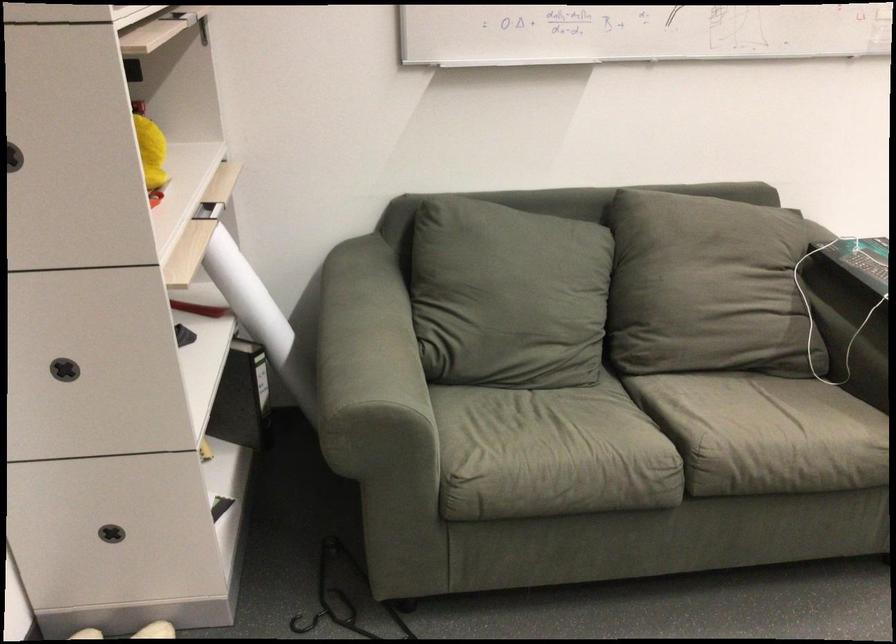
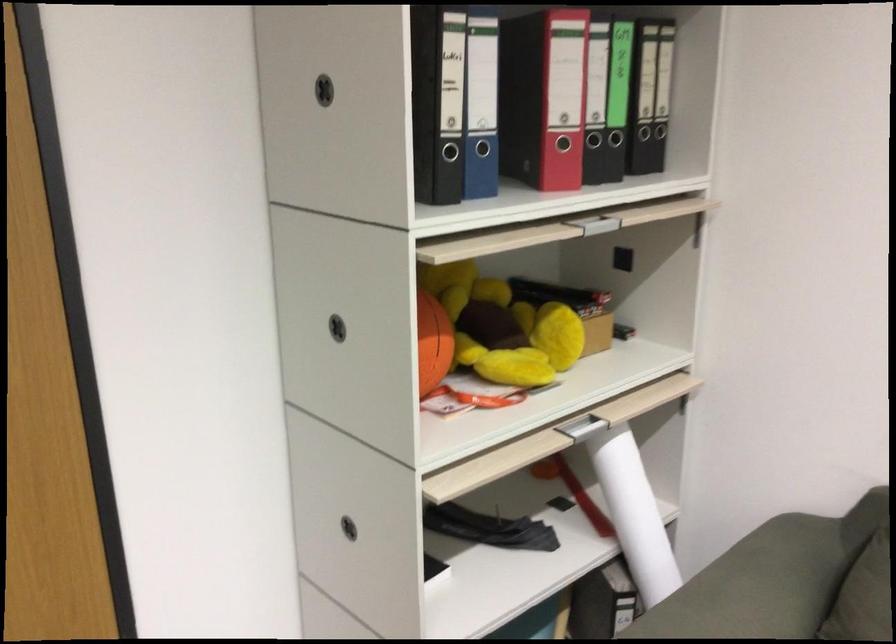
Find the pixel in the second image that matches (250,285) in the first image.

(633, 514)